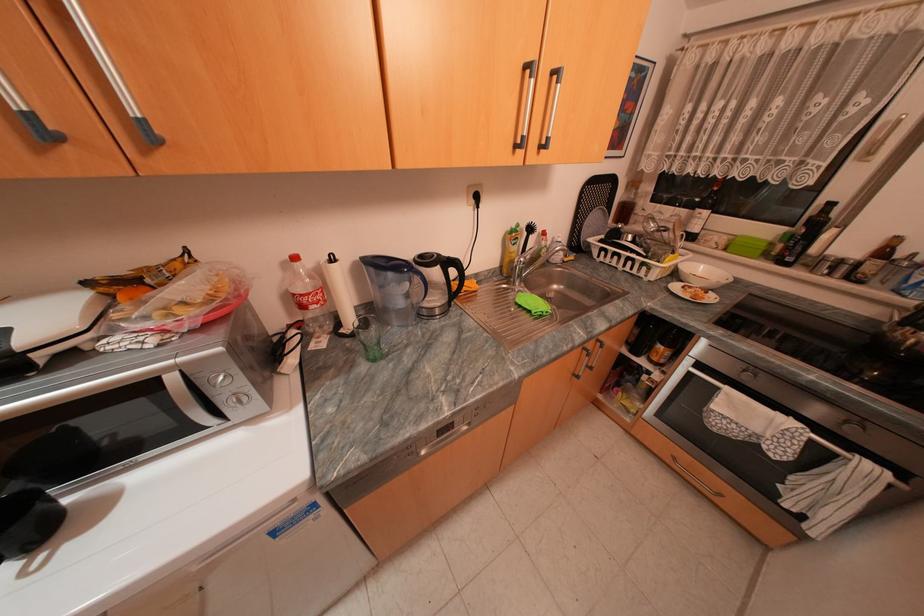
What are the coordinates of `oven door handle` in the screenshot? It's located at (184, 398).